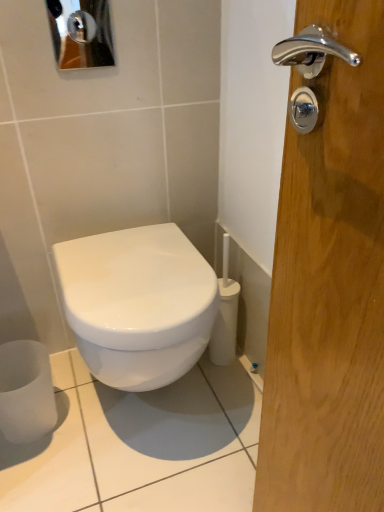
Describe the element at coordinates (26, 391) in the screenshot. This screenshot has width=384, height=512. I see `satin white toilet paper at lower left` at that location.

The image size is (384, 512). I want to click on satin white toilet paper at lower left, so click(x=26, y=391).

From the picture: Is satin white toilet paper at lower left beside metallic reflective mirror at upper left?

No, satin white toilet paper at lower left is not beside metallic reflective mirror at upper left.

Does point (40, 372) come farther from viewer compared to point (52, 27)?

Yes, it is behind point (52, 27).

The height and width of the screenshot is (512, 384). In order to click on toilet paper below the metallic reflective mirror at upper left (from the image's perspective) in this screenshot , I will do `click(26, 391)`.

Does satin white toilet paper at lower left have a greater width compared to metallic reflective mirror at upper left?

Correct, the width of satin white toilet paper at lower left exceeds that of metallic reflective mirror at upper left.

Is white glossy toilet at center placed right next to metallic reflective mirror at upper left?

white glossy toilet at center is not next to metallic reflective mirror at upper left, and they're not touching.

Can you tell me how much white glossy toilet at center and metallic reflective mirror at upper left differ in facing direction?

0.491 degrees.

Locate an element on the screen. mirror located above the white glossy toilet at center (from the image's perspective) is located at coordinates pyautogui.click(x=81, y=33).

Considering the positions of objects satin white toilet paper at lower left and white glossy toilet at center in the image provided, who is in front, satin white toilet paper at lower left or white glossy toilet at center?

white glossy toilet at center is closer to the camera.

Considering the relative sizes of satin white toilet paper at lower left and white glossy toilet at center in the image provided, is satin white toilet paper at lower left thinner than white glossy toilet at center?

Yes.

From the image's perspective, is satin white toilet paper at lower left located beneath white glossy toilet at center?

Indeed, from the image's perspective, satin white toilet paper at lower left is shown beneath white glossy toilet at center.

Is satin white toilet paper at lower left far from white glossy toilet at center?

No, satin white toilet paper at lower left is not far away from white glossy toilet at center.

Does metallic reflective mirror at upper left turn towards white glossy toilet at center?

No, metallic reflective mirror at upper left is not oriented towards white glossy toilet at center.

Does metallic reflective mirror at upper left have a greater height compared to white glossy toilet at center?

In fact, metallic reflective mirror at upper left may be shorter than white glossy toilet at center.

Are metallic reflective mirror at upper left and white glossy toilet at center far apart?

No, metallic reflective mirror at upper left is in close proximity to white glossy toilet at center.

From the image's perspective, is metallic reflective mirror at upper left above white glossy toilet at center?

Yes.

Is metallic reflective mirror at upper left taller than satin white toilet paper at lower left?

Incorrect, the height of metallic reflective mirror at upper left is not larger of that of satin white toilet paper at lower left.

What's the angular difference between metallic reflective mirror at upper left and satin white toilet paper at lower left's facing directions?

0.667 degrees separate the facing orientations of metallic reflective mirror at upper left and satin white toilet paper at lower left.

Between metallic reflective mirror at upper left and satin white toilet paper at lower left, which one appears on the left side from the viewer's perspective?

From the viewer's perspective, satin white toilet paper at lower left appears more on the left side.

Does metallic reflective mirror at upper left touch satin white toilet paper at lower left?

metallic reflective mirror at upper left and satin white toilet paper at lower left are clearly separated.

Is white glossy toilet at center wider or thinner than satin white toilet paper at lower left?

Considering their sizes, white glossy toilet at center looks broader than satin white toilet paper at lower left.

How many degrees apart are the facing directions of white glossy toilet at center and satin white toilet paper at lower left?

They differ by 1.16 degrees in their facing directions.

From the image's perspective, is white glossy toilet at center below satin white toilet paper at lower left?

No.

Which of these two, white glossy toilet at center or satin white toilet paper at lower left, stands taller?

Standing taller between the two is white glossy toilet at center.

Identify the location of toilet paper lying on the left of metallic reflective mirror at upper left. The image size is (384, 512). (26, 391).

Where is `mirror above the white glossy toilet at center (from the image's perspective)`? mirror above the white glossy toilet at center (from the image's perspective) is located at coordinates (81, 33).

Estimate the real-world distances between objects in this image. Which object is further from satin white toilet paper at lower left, metallic reflective mirror at upper left or white glossy toilet at center?

The object further to satin white toilet paper at lower left is metallic reflective mirror at upper left.

Which object lies further to the anchor point metallic reflective mirror at upper left, white glossy toilet at center or satin white toilet paper at lower left?

satin white toilet paper at lower left is positioned further to the anchor metallic reflective mirror at upper left.

Considering their positions, is satin white toilet paper at lower left positioned closer to metallic reflective mirror at upper left than white glossy toilet at center?

The object closer to metallic reflective mirror at upper left is white glossy toilet at center.

Considering their positions, is metallic reflective mirror at upper left positioned closer to white glossy toilet at center than satin white toilet paper at lower left?

satin white toilet paper at lower left lies closer to white glossy toilet at center than the other object.

Estimate the real-world distances between objects in this image. Which object is further from satin white toilet paper at lower left, white glossy toilet at center or metallic reflective mirror at upper left?

metallic reflective mirror at upper left lies further to satin white toilet paper at lower left than the other object.

Looking at the image, which one is located closer to white glossy toilet at center, satin white toilet paper at lower left or metallic reflective mirror at upper left?

satin white toilet paper at lower left is positioned closer to the anchor white glossy toilet at center.

Image resolution: width=384 pixels, height=512 pixels. In order to click on toilet between metallic reflective mirror at upper left and satin white toilet paper at lower left from top to bottom in this screenshot , I will do `click(138, 304)`.